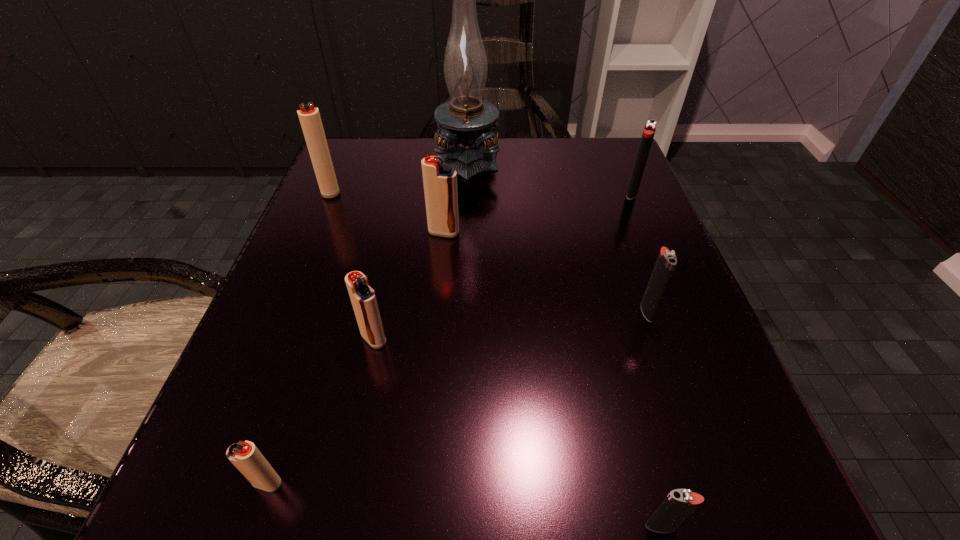
Where is `the second smallest red igniter`? This screenshot has height=540, width=960. the second smallest red igniter is located at coordinates point(363,298).

The height and width of the screenshot is (540, 960). Identify the location of the third object from left to right. (363, 298).

This screenshot has height=540, width=960. I want to click on the second red igniter from left to right, so click(245, 456).

Find the location of a particular element. The image size is (960, 540). the second nearest object is located at coordinates (245, 456).

Identify the location of the smallest black igniter. (680, 503).

Find the location of a particular element. Image resolution: width=960 pixels, height=540 pixels. the leftmost black igniter is located at coordinates (680, 503).

Where is `free space located on the front of the tallest object`? free space located on the front of the tallest object is located at coordinates (463, 294).

Where is `vacant space situated on the right of the biggest red igniter`? Image resolution: width=960 pixels, height=540 pixels. vacant space situated on the right of the biggest red igniter is located at coordinates (381, 191).

Image resolution: width=960 pixels, height=540 pixels. I want to click on free region located 0.090m on the left of the second biggest red igniter, so click(378, 233).

Locate an element on the screen. This screenshot has height=540, width=960. free space located on the front of the farthest black igniter is located at coordinates (646, 226).